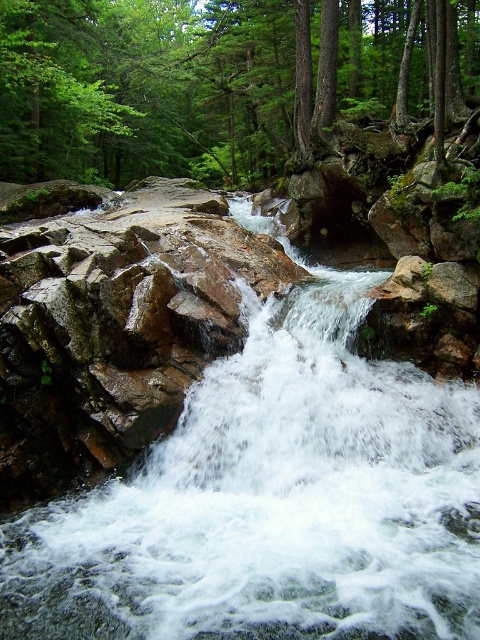
Is point (219, 394) less distant than point (0, 113)?

That is True.

Is white frothy water at center smaller than green matte tree at center?

Yes, white frothy water at center is smaller than green matte tree at center.

Is point (376, 484) positioned before point (420, 44)?

Yes.

Locate an element on the screen. The width and height of the screenshot is (480, 640). white frothy water at center is located at coordinates (273, 500).